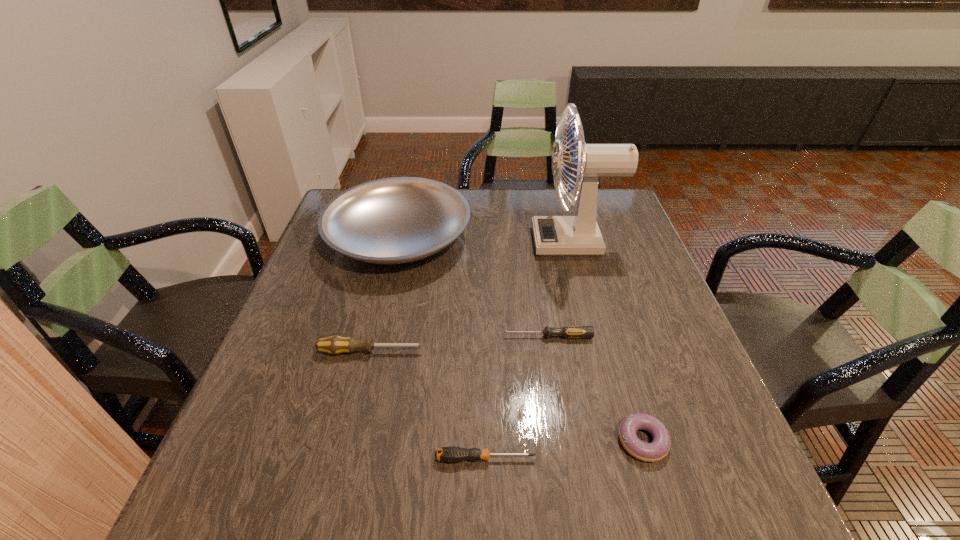
The image size is (960, 540). What are the coordinates of `screwdriver located in the left edge section of the desktop` in the screenshot? It's located at (334, 345).

Find the location of a particular element. The image size is (960, 540). fan at the right edge is located at coordinates (579, 235).

You are a GUI agent. You are given a task and a screenshot of the screen. Output one action in this format:
    pyautogui.click(x=<x>, y=<y>)
    Task: Click on the doughnut that is at the right edge
    This screenshot has width=960, height=540.
    Given the screenshot: What is the action you would take?
    pyautogui.click(x=656, y=450)

You are a GUI agent. You are given a task and a screenshot of the screen. Output one action in this format:
    pyautogui.click(x=<x>, y=<y>)
    Task: Click on the object that is at the far left corner
    
    Given the screenshot: What is the action you would take?
    pyautogui.click(x=396, y=220)

This screenshot has width=960, height=540. What are the coordinates of `object that is at the far right corner` in the screenshot? It's located at (579, 235).

I want to click on free location at the far edge, so click(544, 199).

Identify the location of blank space at the near edge. Image resolution: width=960 pixels, height=540 pixels. (311, 515).

Image resolution: width=960 pixels, height=540 pixels. Identify the location of vacant space at the right edge. (613, 262).

Locate an element on the screen. vacant area at the near left corner is located at coordinates (209, 478).

I want to click on free space at the far right corner of the desktop, so click(618, 208).